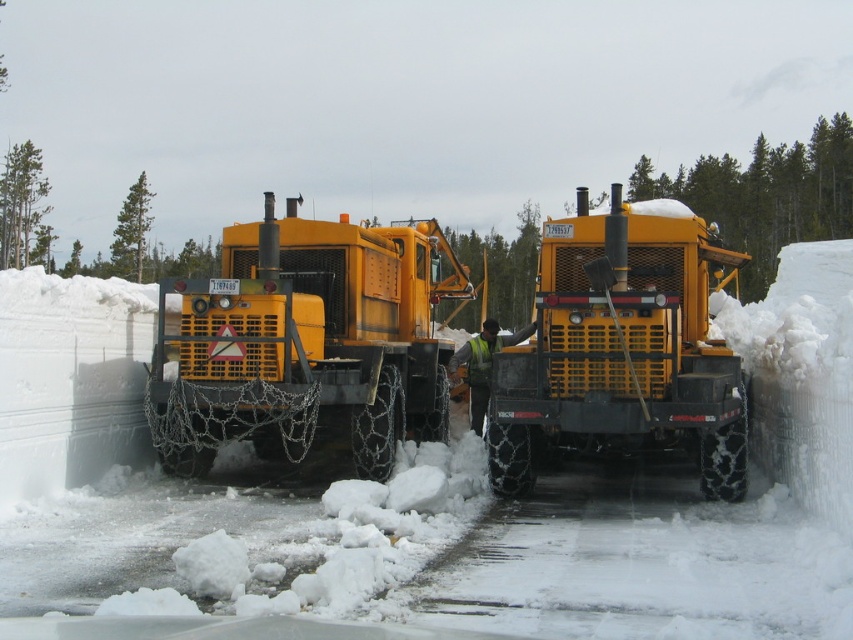
You are a maintenance worker needing to park a third vehicle between the two trucks. The third vehicle requires a minimum of 2 meters of space. Can you fit it between the yellow rubber truck at center and the yellow matte truck at center based on their widths?

The yellow rubber truck at center is wider than the yellow matte truck at center. However, the total space between them isn t provided, so we can t determine if there s enough room for the third vehicle requiring 2 meters. More information is needed about the distance between the trucks, not just their widths.

You are a delivery driver who needs to park your truck on the snowy road where the white fluffy snow at center and the yellow rubber truck at center are located. Considering the snow depth, will your truck sink into the snow up to its axles?

The white fluffy snow at center has a lesser height compared to yellow rubber truck at center, meaning the snow is not deep enough to reach the axles of the truck. Therefore, the truck will not sink into the snow up to its axles.